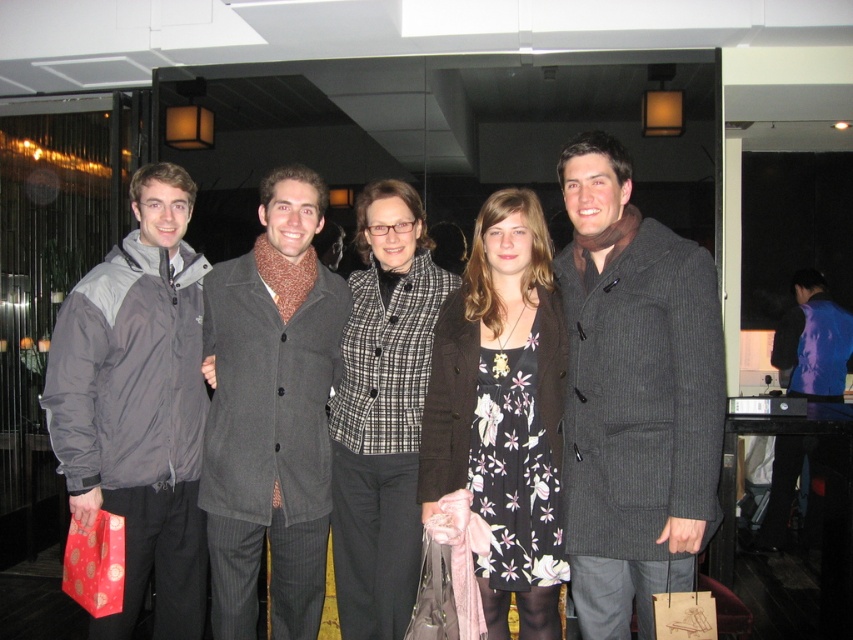
You are organizing a clothing donation drive and need to determine if the gray synthetic jacket at left and the floral print dress at center can fit into a standard donation bin that has a maximum capacity of 2 cubic feet. Given their sizes, will both items fit comfortably without overcrowding the bin?

The gray synthetic jacket at left is larger in size than the floral print dress at center. However, since the bin has a capacity of 2 cubic feet, both items can likely fit comfortably as long as they are folded properly, though the larger jacket may take up more space.

You are a photographer adjusting the camera settings to ensure both the dark gray pinstripe coat at center and the plaid wool jacket at center are in focus. Which of the two coats should you adjust the focus for first to account for their height difference?

The dark gray pinstripe coat at center is shorter than the plaid wool jacket at center, so you should focus on the plaid wool jacket at center first to ensure its details are sharp before adjusting for the shorter coat.